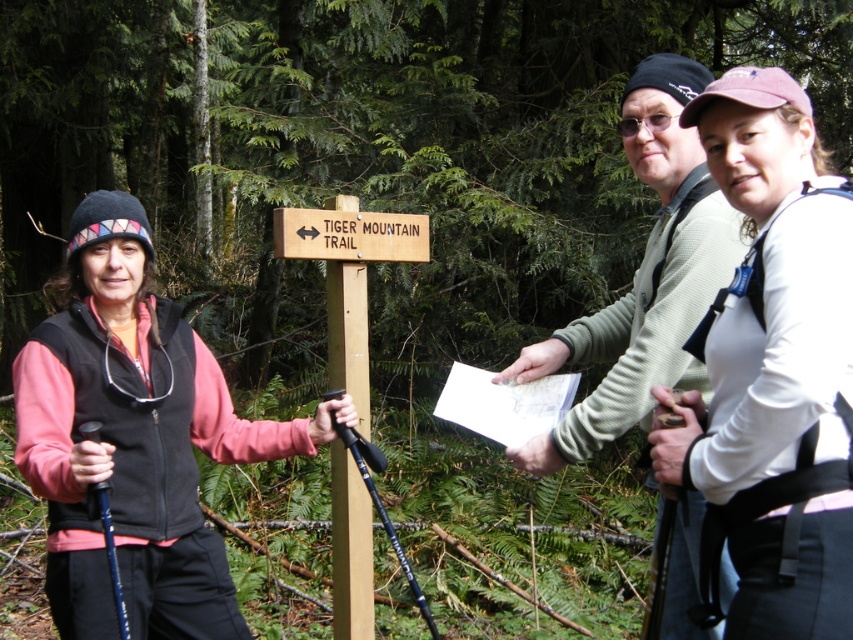
Question: Which point is farther to the camera?

Choices:
 (A) light gray sweater at center
 (B) brushed metal hiking poles at left
 (C) white matte shirt at upper right

Answer: (A)

Question: Which point is farther to the camera?

Choices:
 (A) (126, 204)
 (B) (674, 163)

Answer: (B)

Question: Does white matte shirt at upper right have a larger size compared to brushed metal hiking poles at left?

Choices:
 (A) no
 (B) yes

Answer: (A)

Question: Which point is closer to the camera?

Choices:
 (A) white matte shirt at upper right
 (B) brushed metal hiking poles at left
 (C) light gray sweater at center

Answer: (A)

Question: Is brushed metal hiking poles at left closer to camera compared to light gray sweater at center?

Choices:
 (A) no
 (B) yes

Answer: (B)

Question: Is white matte shirt at upper right positioned behind brushed metal hiking poles at left?

Choices:
 (A) yes
 (B) no

Answer: (B)